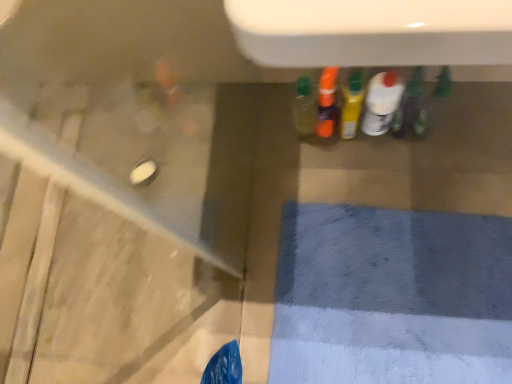
At what (x,y) coordinates should I click in order to perform the action: click on translucent plastic bottle at center, the fifth bottle positioned from the right. Please return your answer as a coordinate pair (x, y). Looking at the image, I should click on (304, 107).

What do you see at coordinates (382, 102) in the screenshot? I see `white glossy bottle at center, the fourth bottle positioned from the left` at bounding box center [382, 102].

Image resolution: width=512 pixels, height=384 pixels. In order to click on translucent plastic bottle at center, arranged as the third bottle when viewed from the right in this screenshot , I will do `click(351, 104)`.

Is translucent orange bottle at center, the fourth bottle positioned from the right, bigger than green matte bottle at center, marked as the 1th bottle in a right-to-left arrangement?

Yes, translucent orange bottle at center, the fourth bottle positioned from the right, is bigger than green matte bottle at center, marked as the 1th bottle in a right-to-left arrangement.

From the image's perspective, between translucent orange bottle at center, the 2th bottle when ordered from left to right, and green matte bottle at center, marked as the 1th bottle in a right-to-left arrangement, who is located below?

green matte bottle at center, marked as the 1th bottle in a right-to-left arrangement, is shown below in the image.

Which object is wider, translucent orange bottle at center, the fourth bottle positioned from the right, or green matte bottle at center, which ranks as the 5th bottle in left-to-right order?

translucent orange bottle at center, the fourth bottle positioned from the right, is wider.

Does translucent orange bottle at center, the fourth bottle positioned from the right, appear on the right side of green matte bottle at center, marked as the 1th bottle in a right-to-left arrangement?

Incorrect, translucent orange bottle at center, the fourth bottle positioned from the right, is not on the right side of green matte bottle at center, marked as the 1th bottle in a right-to-left arrangement.

Would you consider translucent plastic bottle at center, which ranks as the third bottle in left-to-right order, to be distant from translucent plastic bottle at center, placed as the first bottle when sorted from left to right?

No.

Can you tell me how much translucent plastic bottle at center, which ranks as the third bottle in left-to-right order, and translucent plastic bottle at center, the fifth bottle positioned from the right, differ in facing direction?

There is a 4.61-degree angle between the facing directions of translucent plastic bottle at center, which ranks as the third bottle in left-to-right order, and translucent plastic bottle at center, the fifth bottle positioned from the right.

Consider the image. Who is smaller, translucent plastic bottle at center, which ranks as the third bottle in left-to-right order, or translucent plastic bottle at center, placed as the first bottle when sorted from left to right?

translucent plastic bottle at center, placed as the first bottle when sorted from left to right, is smaller.

Which object is positioned more to the right, translucent plastic bottle at center, arranged as the third bottle when viewed from the right, or translucent plastic bottle at center, the fifth bottle positioned from the right?

translucent plastic bottle at center, arranged as the third bottle when viewed from the right, is more to the right.

Is translucent plastic bottle at center, arranged as the third bottle when viewed from the right, located outside translucent orange bottle at center, the fourth bottle positioned from the right?

Absolutely, translucent plastic bottle at center, arranged as the third bottle when viewed from the right, is external to translucent orange bottle at center, the fourth bottle positioned from the right.

Where is `bottle that is above the translucent plastic bottle at center, arranged as the third bottle when viewed from the right (from the image's perspective)`? Image resolution: width=512 pixels, height=384 pixels. bottle that is above the translucent plastic bottle at center, arranged as the third bottle when viewed from the right (from the image's perspective) is located at coordinates (327, 102).

What's the angular difference between translucent plastic bottle at center, arranged as the third bottle when viewed from the right, and translucent orange bottle at center, the 2th bottle when ordered from left to right,'s facing directions?

There is a 4.35-degree angle between the facing directions of translucent plastic bottle at center, arranged as the third bottle when viewed from the right, and translucent orange bottle at center, the 2th bottle when ordered from left to right.

Measure the distance between white glossy bottle at center, the fourth bottle positioned from the left, and translucent orange bottle at center, the fourth bottle positioned from the right.

They are 4.56 inches apart.

From a real-world perspective, is white glossy bottle at center, the second bottle positioned from the right, on top of translucent orange bottle at center, the fourth bottle positioned from the right?

Incorrect, from a real-world perspective, white glossy bottle at center, the second bottle positioned from the right, is lower than translucent orange bottle at center, the fourth bottle positioned from the right.

The width and height of the screenshot is (512, 384). Find the location of `the 2nd bottle to the left when counting from the white glossy bottle at center, the second bottle positioned from the right`. the 2nd bottle to the left when counting from the white glossy bottle at center, the second bottle positioned from the right is located at coordinates (327, 102).

Would you consider white glossy bottle at center, the fourth bottle positioned from the left, to be distant from translucent orange bottle at center, the 2th bottle when ordered from left to right?

They are positioned close to each other.

Is point (331, 96) closer or farther from the camera than point (360, 110)?

Point (331, 96).

From a real-world perspective, starting from the translucent plastic bottle at center, which ranks as the third bottle in left-to-right order, which bottle is the 2nd one below it? Please provide its 2D coordinates.

[(327, 102)]

Based on their positions, is translucent orange bottle at center, the fourth bottle positioned from the right, located to the left or right of translucent plastic bottle at center, arranged as the third bottle when viewed from the right?

In the image, translucent orange bottle at center, the fourth bottle positioned from the right, appears on the left side of translucent plastic bottle at center, arranged as the third bottle when viewed from the right.

Is translucent plastic bottle at center, arranged as the third bottle when viewed from the right, at the back of translucent orange bottle at center, the 2th bottle when ordered from left to right?

No.

Between green matte bottle at center, marked as the 1th bottle in a right-to-left arrangement, and translucent plastic bottle at center, placed as the first bottle when sorted from left to right, which one has larger size?

translucent plastic bottle at center, placed as the first bottle when sorted from left to right.

Is point (399, 125) closer or farther from the camera than point (296, 110)?

Point (399, 125).

From a real-world perspective, count 2nd bottles upward from the green matte bottle at center, which ranks as the 5th bottle in left-to-right order, and point to it. Please provide its 2D coordinates.

[(304, 107)]

Based on their positions, is green matte bottle at center, marked as the 1th bottle in a right-to-left arrangement, located to the left or right of translucent plastic bottle at center, placed as the first bottle when sorted from left to right?

green matte bottle at center, marked as the 1th bottle in a right-to-left arrangement, is positioned on translucent plastic bottle at center, placed as the first bottle when sorted from left to right,'s right side.

Can you tell me how much white glossy bottle at center, the fourth bottle positioned from the left, and green matte bottle at center, which ranks as the 5th bottle in left-to-right order, differ in facing direction?

The angle between the facing direction of white glossy bottle at center, the fourth bottle positioned from the left, and the facing direction of green matte bottle at center, which ranks as the 5th bottle in left-to-right order, is 0.0012 degrees.

Which is nearer, (x=382, y=86) or (x=405, y=117)?

Point (x=382, y=86)

Is white glossy bottle at center, the fourth bottle positioned from the left, taller than green matte bottle at center, marked as the 1th bottle in a right-to-left arrangement?

Incorrect, the height of white glossy bottle at center, the fourth bottle positioned from the left, is not larger of that of green matte bottle at center, marked as the 1th bottle in a right-to-left arrangement.

Is white glossy bottle at center, the fourth bottle positioned from the left, inside or outside of green matte bottle at center, which ranks as the 5th bottle in left-to-right order?

The correct answer is: outside.

Locate an element on the screen. The height and width of the screenshot is (384, 512). the 3rd bottle in front of the translucent orange bottle at center, the 2th bottle when ordered from left to right is located at coordinates (411, 108).

The image size is (512, 384). I want to click on bottle that is the 1st object directly below the translucent plastic bottle at center, placed as the first bottle when sorted from left to right (from a real-world perspective), so click(351, 104).

Which object lies nearer to the anchor point translucent orange bottle at center, the 2th bottle when ordered from left to right, green matte bottle at center, which ranks as the 5th bottle in left-to-right order, or translucent plastic bottle at center, which ranks as the third bottle in left-to-right order?

The object closer to translucent orange bottle at center, the 2th bottle when ordered from left to right, is translucent plastic bottle at center, which ranks as the third bottle in left-to-right order.

Estimate the real-world distances between objects in this image. Which object is closer to translucent orange bottle at center, the 2th bottle when ordered from left to right, translucent plastic bottle at center, placed as the first bottle when sorted from left to right, or translucent plastic bottle at center, which ranks as the third bottle in left-to-right order?

Based on the image, translucent plastic bottle at center, which ranks as the third bottle in left-to-right order, appears to be nearer to translucent orange bottle at center, the 2th bottle when ordered from left to right.

Estimate the real-world distances between objects in this image. Which object is further from green matte bottle at center, which ranks as the 5th bottle in left-to-right order, white glossy bottle at center, the second bottle positioned from the right, or translucent plastic bottle at center, the fifth bottle positioned from the right?

translucent plastic bottle at center, the fifth bottle positioned from the right, is positioned further to the anchor green matte bottle at center, which ranks as the 5th bottle in left-to-right order.

Estimate the real-world distances between objects in this image. Which object is closer to white glossy bottle at center, the second bottle positioned from the right, translucent plastic bottle at center, arranged as the third bottle when viewed from the right, or green matte bottle at center, which ranks as the 5th bottle in left-to-right order?

Based on the image, translucent plastic bottle at center, arranged as the third bottle when viewed from the right, appears to be nearer to white glossy bottle at center, the second bottle positioned from the right.

Which object lies further to the anchor point translucent orange bottle at center, the fourth bottle positioned from the right, white glossy bottle at center, the second bottle positioned from the right, or translucent plastic bottle at center, placed as the first bottle when sorted from left to right?

Among the two, white glossy bottle at center, the second bottle positioned from the right, is located further to translucent orange bottle at center, the fourth bottle positioned from the right.

When comparing their distances from translucent orange bottle at center, the 2th bottle when ordered from left to right, does translucent plastic bottle at center, placed as the first bottle when sorted from left to right, or white glossy bottle at center, the fourth bottle positioned from the left, seem further?

white glossy bottle at center, the fourth bottle positioned from the left, lies further to translucent orange bottle at center, the 2th bottle when ordered from left to right, than the other object.

Estimate the real-world distances between objects in this image. Which object is further from translucent plastic bottle at center, placed as the first bottle when sorted from left to right, green matte bottle at center, which ranks as the 5th bottle in left-to-right order, or translucent plastic bottle at center, arranged as the third bottle when viewed from the right?

green matte bottle at center, which ranks as the 5th bottle in left-to-right order, lies further to translucent plastic bottle at center, placed as the first bottle when sorted from left to right, than the other object.

Considering their positions, is translucent plastic bottle at center, which ranks as the third bottle in left-to-right order, positioned closer to translucent plastic bottle at center, the fifth bottle positioned from the right, than translucent orange bottle at center, the 2th bottle when ordered from left to right?

translucent orange bottle at center, the 2th bottle when ordered from left to right, is positioned closer to the anchor translucent plastic bottle at center, the fifth bottle positioned from the right.

Locate an element on the screen. bottle between translucent orange bottle at center, the 2th bottle when ordered from left to right, and white glossy bottle at center, the second bottle positioned from the right, in the horizontal direction is located at coordinates (351, 104).

Locate an element on the screen. This screenshot has height=384, width=512. bottle located between translucent plastic bottle at center, placed as the first bottle when sorted from left to right, and translucent plastic bottle at center, arranged as the third bottle when viewed from the right, in the left-right direction is located at coordinates (327, 102).

I want to click on bottle situated between translucent plastic bottle at center, arranged as the third bottle when viewed from the right, and green matte bottle at center, marked as the 1th bottle in a right-to-left arrangement, from left to right, so click(382, 102).